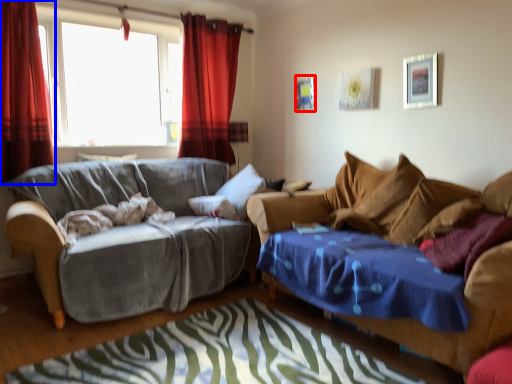
Question: Which object appears farthest to the camera in this image, picture frame (highlighted by a red box) or curtain (highlighted by a blue box)?

Choices:
 (A) picture frame
 (B) curtain

Answer: (A)